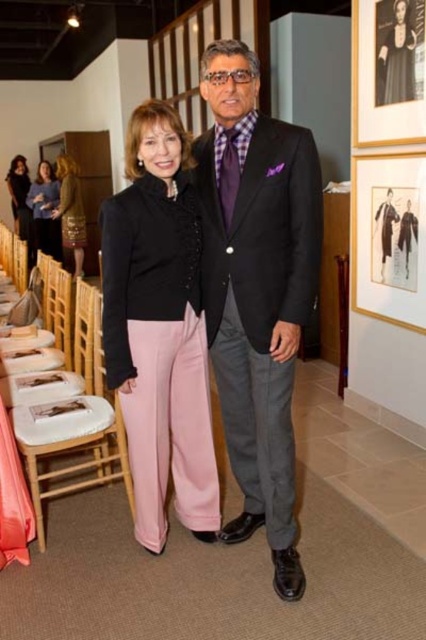
Question: From the image, what is the correct spatial relationship of matte black blazer at center in relation to matte black dress at left?

Choices:
 (A) right
 (B) left

Answer: (A)

Question: Can you confirm if matte black suit at center is bigger than wooden picture frame at upper right?

Choices:
 (A) no
 (B) yes

Answer: (B)

Question: Which of these objects is positioned farthest from the matte black dress at upper left?

Choices:
 (A) matte black blazer at center
 (B) wooden picture frame at upper right
 (C) matte black dress at left

Answer: (A)

Question: Estimate the real-world distances between objects in this image. Which object is closer to the wooden chair at lower left?

Choices:
 (A) gold-framed picture at right
 (B) matte black suit at center

Answer: (B)

Question: Estimate the real-world distances between objects in this image. Which object is farther from the matte black suit at center?

Choices:
 (A) matte black dress at left
 (B) matte black blazer at center
 (C) matte black dress at upper left
 (D) wooden chair at lower left

Answer: (A)

Question: Can you confirm if wooden chair at lower left is positioned to the right of matte black dress at left?

Choices:
 (A) no
 (B) yes

Answer: (B)